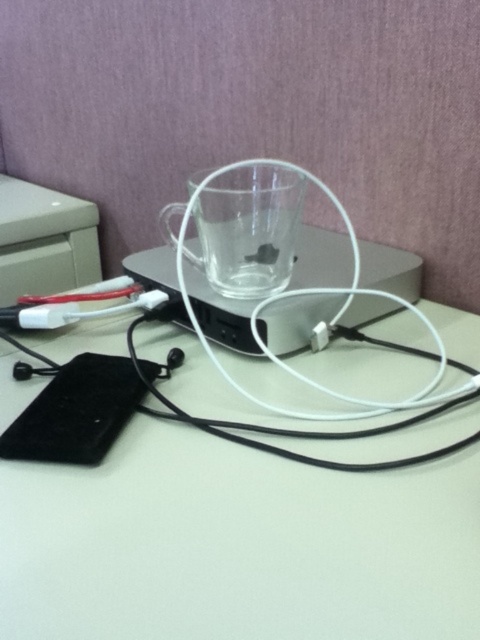
You need to place a small keychain on the desk without blocking the charging station. Given the objects present, can the white matte table at lower center accommodate the black rubber earphone at lower center along with the keychain?

The white matte table at lower center has a larger width than the black rubber earphone at lower center, so it should have enough space to place both the keychain and the earphone without blocking the charging station.

You are trying to reach for two points on the desk. The first point is at coordinate point(283, 620) and the second is at point(181, 356). Which point is physically closer to you?

Point(283, 620) is closer to the viewer than point(181, 356).